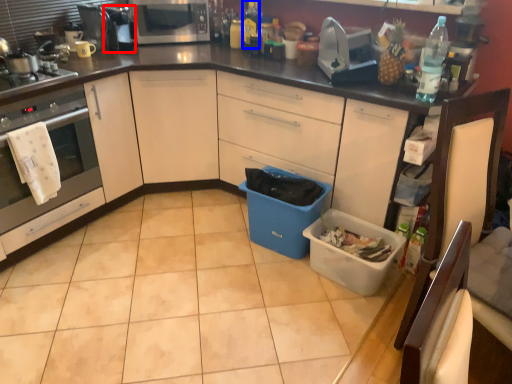
Question: Which point is closer to the camera, appliance (highlighted by a red box) or bottle (highlighted by a blue box)?

Choices:
 (A) appliance
 (B) bottle

Answer: (A)